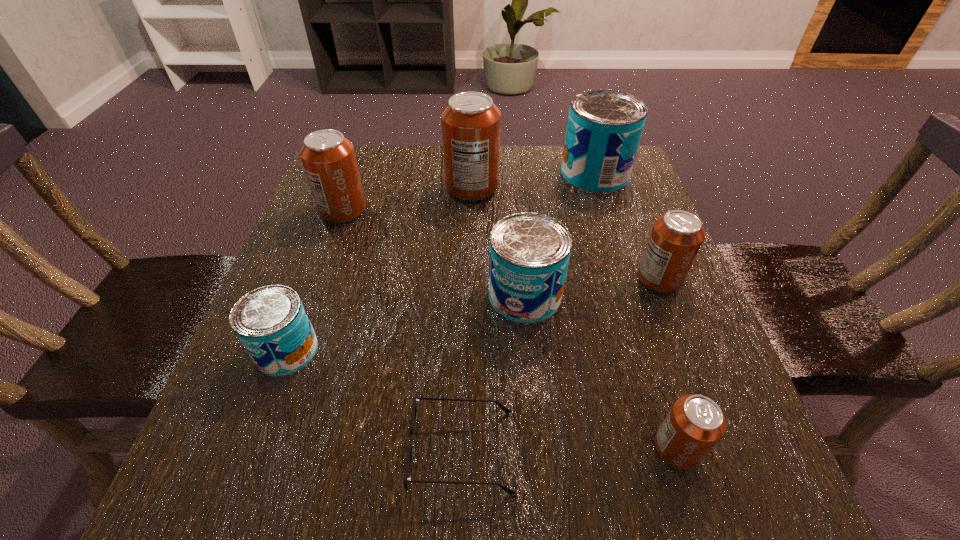
Where is `blank space located 0.060m with the lenses facing outward on the shortest object`? blank space located 0.060m with the lenses facing outward on the shortest object is located at coordinates (556, 451).

Image resolution: width=960 pixels, height=540 pixels. In order to click on can present at the near edge in this screenshot , I will do `click(694, 425)`.

You are a GUI agent. You are given a task and a screenshot of the screen. Output one action in this format:
    pyautogui.click(x=<x>, y=<y>)
    Task: Click on the spectacles that is at the near edge
    Image resolution: width=960 pixels, height=540 pixels.
    Given the screenshot: What is the action you would take?
    pyautogui.click(x=407, y=478)

Find the location of `object that is at the far left corner`. object that is at the far left corner is located at coordinates point(328,158).

The width and height of the screenshot is (960, 540). Identify the location of object located in the far right corner section of the desktop. (604, 128).

This screenshot has height=540, width=960. In order to click on object that is at the near right corner in this screenshot , I will do `click(694, 425)`.

Image resolution: width=960 pixels, height=540 pixels. I want to click on vacant space at the far edge, so click(393, 175).

Where is `vacant space at the near edge of the desktop`? The width and height of the screenshot is (960, 540). vacant space at the near edge of the desktop is located at coordinates (597, 460).

Locate an element on the screen. The image size is (960, 540). free space at the left edge of the desktop is located at coordinates (329, 382).

Where is `free space at the right edge`? The width and height of the screenshot is (960, 540). free space at the right edge is located at coordinates (590, 203).